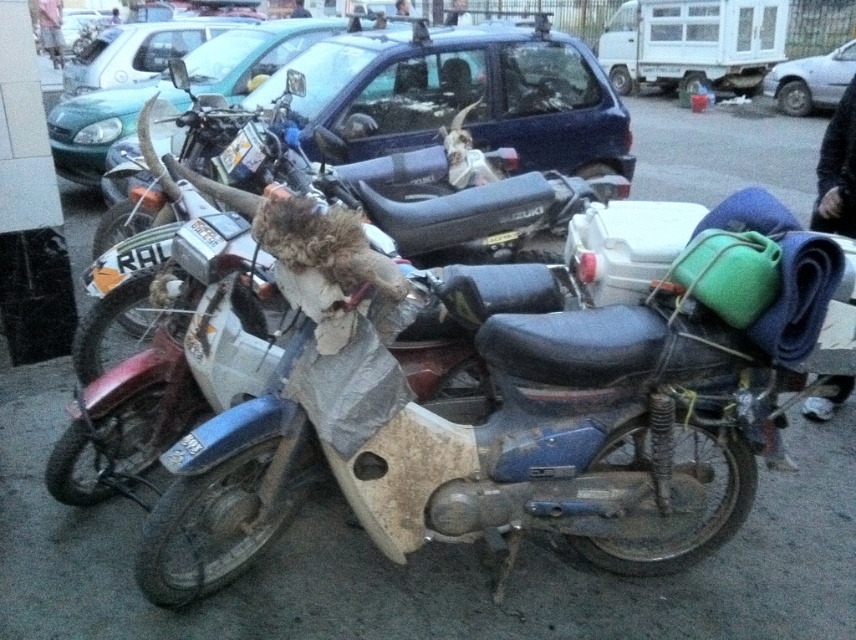
Does green matte car at upper left have a larger size compared to metallic silver car at upper center?

Yes, green matte car at upper left is bigger than metallic silver car at upper center.

Can you confirm if green matte car at upper left is positioned to the right of metallic silver car at upper center?

Incorrect, green matte car at upper left is not on the right side of metallic silver car at upper center.

The height and width of the screenshot is (640, 856). What are the coordinates of `green matte car at upper left` in the screenshot? It's located at (100, 125).

This screenshot has width=856, height=640. In order to click on green matte car at upper left in this screenshot , I will do `click(100, 125)`.